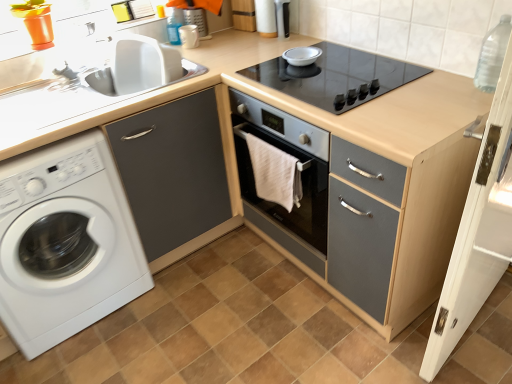
This screenshot has width=512, height=384. What are the coordinates of `vacant space to the left of white wood screen door at right` in the screenshot? It's located at (357, 342).